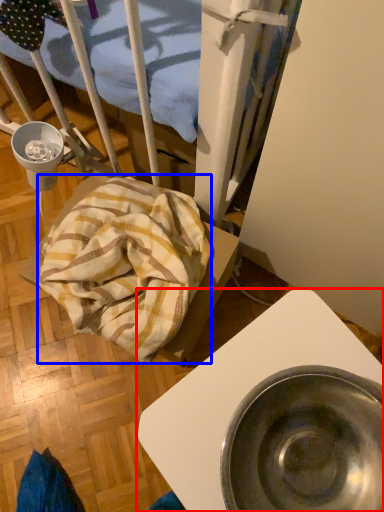
Question: Which object appears farthest to the camera in this image, furniture (highlighted by a red box) or blanket (highlighted by a blue box)?

Choices:
 (A) furniture
 (B) blanket

Answer: (B)